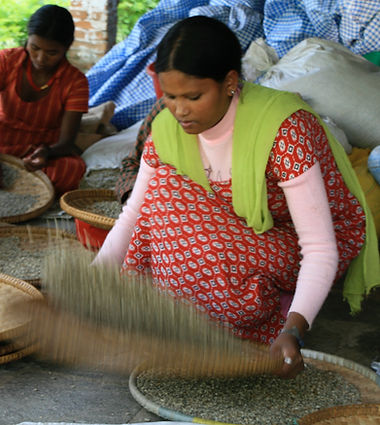
The image size is (380, 425). Find the location of `brick column`. brick column is located at coordinates (92, 21).